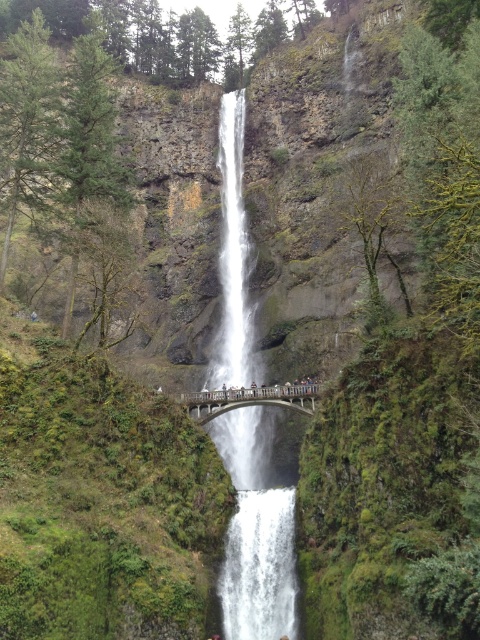
You are standing on the smooth gray bridge at center and want to cross to the other side. Can you walk across the bridge while keeping a distance of 1 meter between yourself and the smooth skin person at center who is also on the bridge?

The smooth gray bridge at center is wider than the smooth skin person at center, so yes, you can walk across the bridge while maintaining a 1 meter distance from the person.